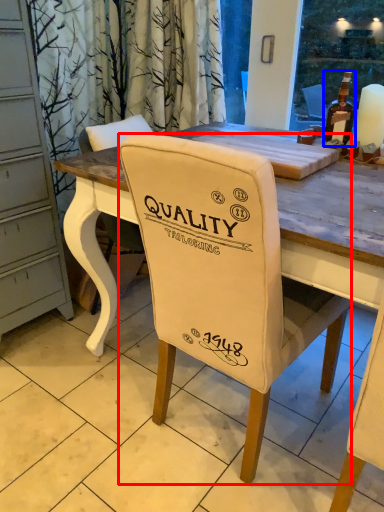
Question: Which object appears closest to the camera in this image, chair (highlighted by a red box) or bottle (highlighted by a blue box)?

Choices:
 (A) chair
 (B) bottle

Answer: (A)